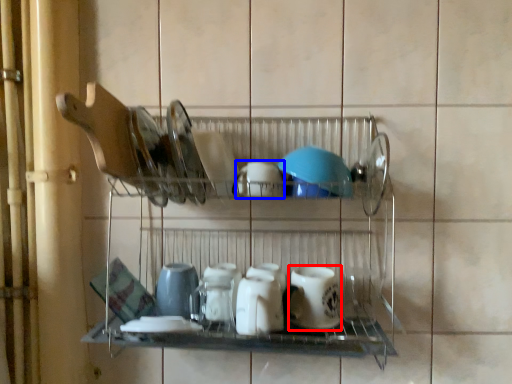
Question: Which object is further to the camera taking this photo, tableware (highlighted by a red box) or tableware (highlighted by a blue box)?

Choices:
 (A) tableware
 (B) tableware

Answer: (A)